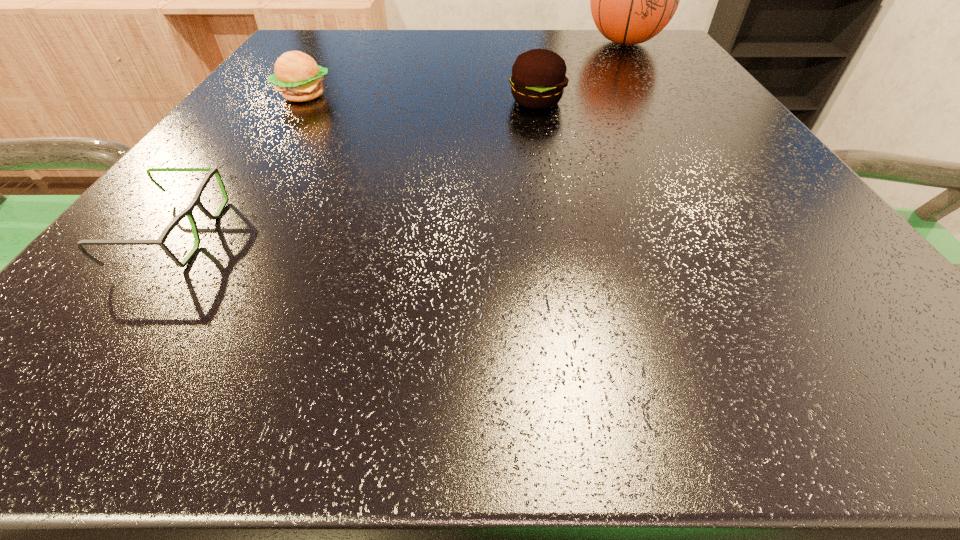
At what (x,y) coordinates should I click in order to perform the action: click on vacant space at the near left corner of the desktop. Please return your answer as a coordinate pair (x, y). Looking at the image, I should click on (58, 316).

The height and width of the screenshot is (540, 960). In order to click on vacant space at the far right corner in this screenshot , I will do `click(615, 52)`.

Find the location of a particular element. The width and height of the screenshot is (960, 540). vacant space at the near right corner of the desktop is located at coordinates (746, 328).

Image resolution: width=960 pixels, height=540 pixels. Find the location of `vacant area that lies between the hamburger and the tallest object`. vacant area that lies between the hamburger and the tallest object is located at coordinates (465, 69).

I want to click on unoccupied area between the hamburger and the tallest object, so click(465, 69).

Image resolution: width=960 pixels, height=540 pixels. Identify the location of free space between the rightmost object and the nearest object. (398, 138).

Identify the location of vacant space in between the hamburger and the basketball. (465, 69).

Locate an element on the screen. This screenshot has width=960, height=540. unoccupied position between the farthest object and the hamburger is located at coordinates (465, 69).

Locate an element on the screen. The width and height of the screenshot is (960, 540). free space that is in between the hamburger and the basketball is located at coordinates (465, 69).

The height and width of the screenshot is (540, 960). I want to click on free space between the hamburger and the basketball, so click(x=465, y=69).